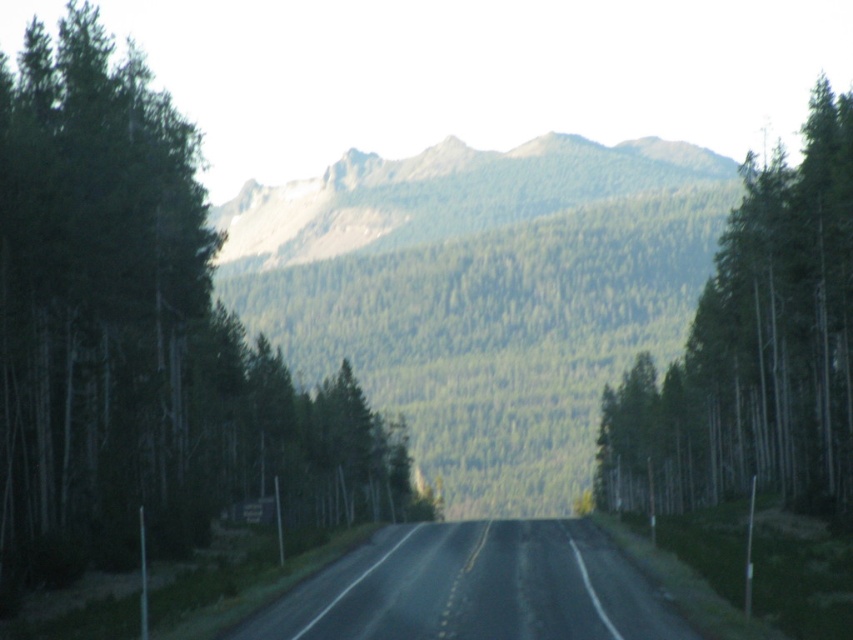
You are a hiker planning to take a photo of the green forested mountain at center. There is a green textured tree at left in the way. Can you move to the right to get a better view of the mountain without the tree blocking the shot?

The green textured tree at left is positioned on the left side of the green forested mountain at center, so moving to the right would allow you to see the mountain without the tree blocking the view.